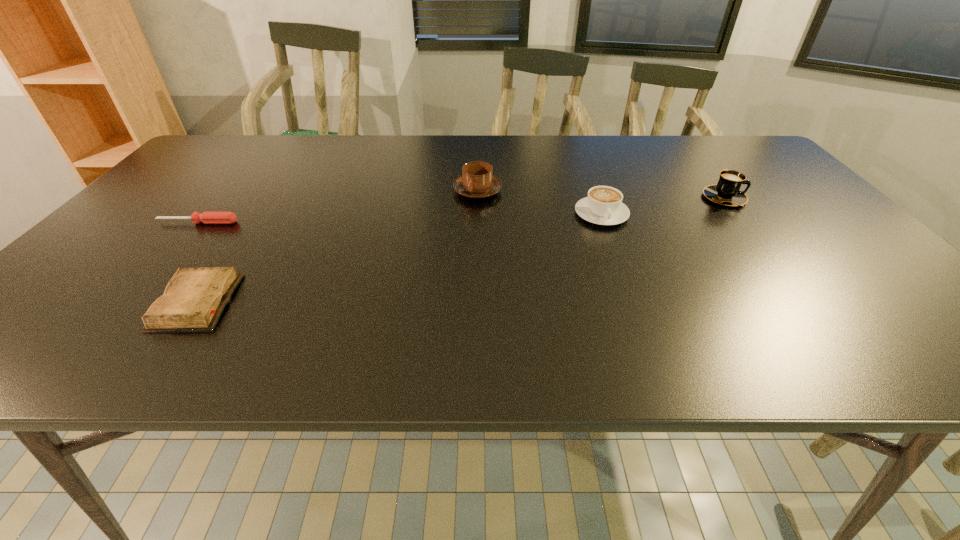
Where is `the third object from right to left`? The width and height of the screenshot is (960, 540). the third object from right to left is located at coordinates (477, 181).

Where is `the rightmost cappuccino`? the rightmost cappuccino is located at coordinates (727, 192).

This screenshot has width=960, height=540. I want to click on the third shortest object, so click(603, 205).

Locate an element on the screen. The width and height of the screenshot is (960, 540). the shortest cappuccino is located at coordinates (603, 205).

Identify the location of the nearest object. (194, 299).

I want to click on screwdriver, so click(206, 217).

You are a GUI agent. You are given a task and a screenshot of the screen. Output one action in this format:
    pyautogui.click(x=<x>, y=<y>)
    Task: Click on the free space located on the side of the third object from right to left with the handle
    This screenshot has height=540, width=960.
    Given the screenshot: What is the action you would take?
    pyautogui.click(x=477, y=251)

Find the location of a particular element. The image size is (960, 540). free location located on the front of the rightmost cappuccino is located at coordinates (756, 238).

Find the location of a particular element. Image resolution: width=960 pixels, height=540 pixels. vacant region located on the side of the third tallest object with the handle is located at coordinates (625, 276).

At what (x,y) coordinates should I click in order to perform the action: click on vacant area located 0.350m on the back of the nearest object. Please return your answer as a coordinate pair (x, y). Looking at the image, I should click on (271, 194).